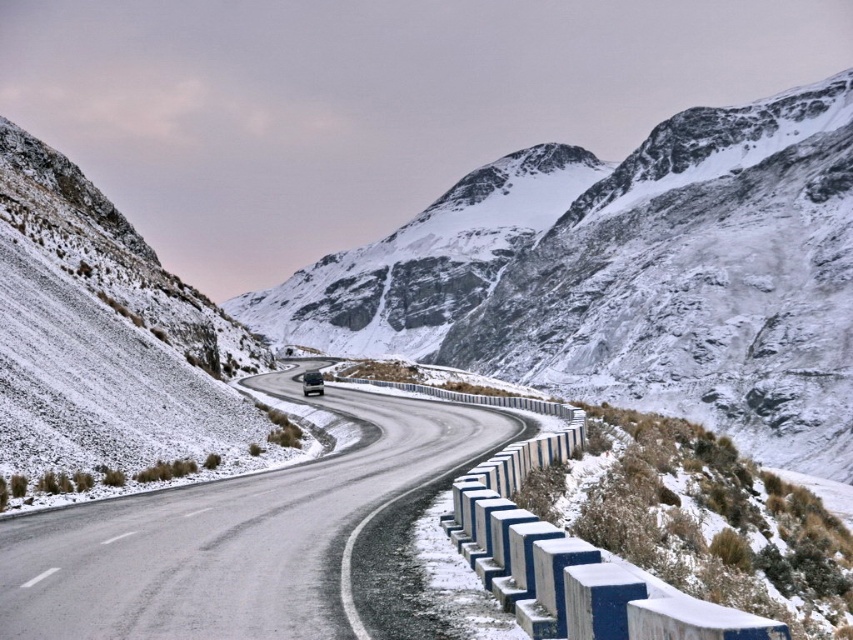
Question: Does black asphalt road at center lie in front of dark gray metallic car at center?

Choices:
 (A) yes
 (B) no

Answer: (A)

Question: Does black asphalt road at center have a lesser width compared to dark gray metallic car at center?

Choices:
 (A) yes
 (B) no

Answer: (B)

Question: Which point is closer to the camera?

Choices:
 (A) (318, 378)
 (B) (293, 586)

Answer: (B)

Question: In this image, where is black asphalt road at center located relative to dark gray metallic car at center?

Choices:
 (A) right
 (B) left

Answer: (A)

Question: Which point is farther to the camera?

Choices:
 (A) dark gray metallic car at center
 (B) black asphalt road at center

Answer: (A)